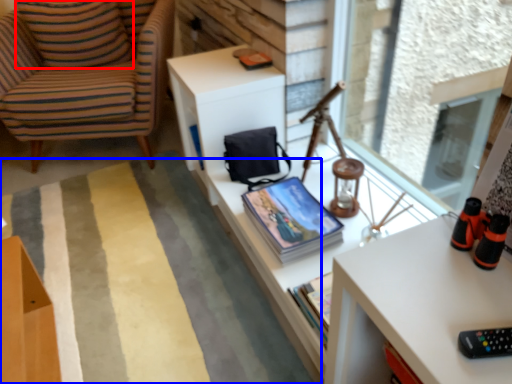
Question: Among these objects, which one is farthest to the camera, pillow (highlighted by a red box) or plain (highlighted by a blue box)?

Choices:
 (A) pillow
 (B) plain

Answer: (A)